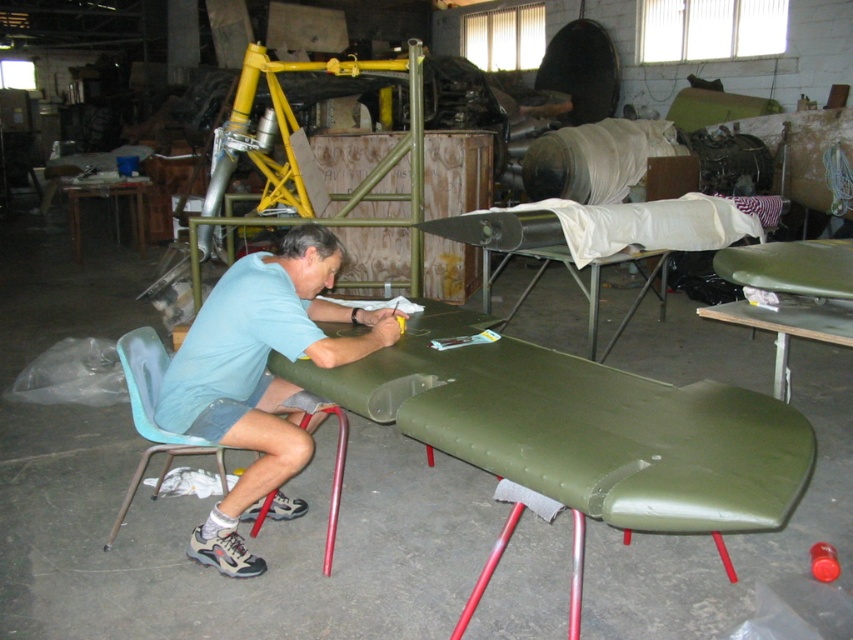
Question: Does light blue t-shirt at center lie in front of teal plastic chair at lower left?

Choices:
 (A) yes
 (B) no

Answer: (A)

Question: From the image, what is the correct spatial relationship of light blue t-shirt at center in relation to teal plastic chair at lower left?

Choices:
 (A) above
 (B) below

Answer: (A)

Question: Observing the image, what is the correct spatial positioning of olive-green matte/leather-like airplane wing at center in reference to teal plastic chair at lower left?

Choices:
 (A) above
 (B) below

Answer: (A)

Question: Which of the following is the farthest from the observer?

Choices:
 (A) (177, 412)
 (B) (152, 452)
 (C) (538, 465)

Answer: (B)

Question: Estimate the real-world distances between objects in this image. Which object is farther from the olive-green matte/leather-like airplane wing at center?

Choices:
 (A) light blue t-shirt at center
 (B) teal plastic chair at lower left

Answer: (B)

Question: Which of the following is the closest to the observer?

Choices:
 (A) click(x=428, y=444)
 (B) click(x=212, y=289)

Answer: (A)